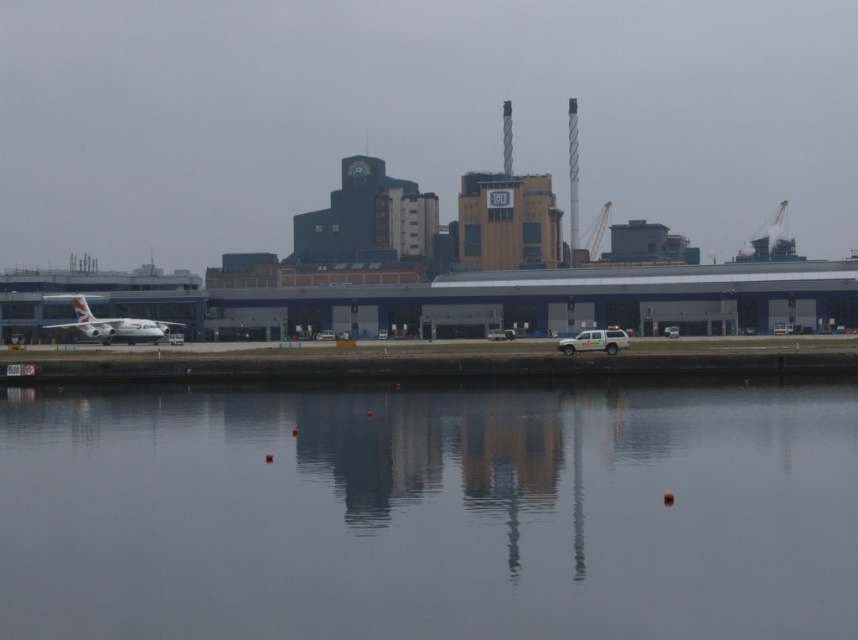
Question: Does transparent glass water at center have a lesser width compared to silver metallic airplane at left?

Choices:
 (A) yes
 (B) no

Answer: (B)

Question: Does transparent glass water at center have a larger size compared to silver metallic airplane at left?

Choices:
 (A) no
 (B) yes

Answer: (A)

Question: Which point is closer to the camera?

Choices:
 (A) pyautogui.click(x=112, y=330)
 (B) pyautogui.click(x=486, y=589)

Answer: (B)

Question: Can you confirm if transparent glass water at center is positioned to the right of silver metallic airplane at left?

Choices:
 (A) no
 (B) yes

Answer: (B)